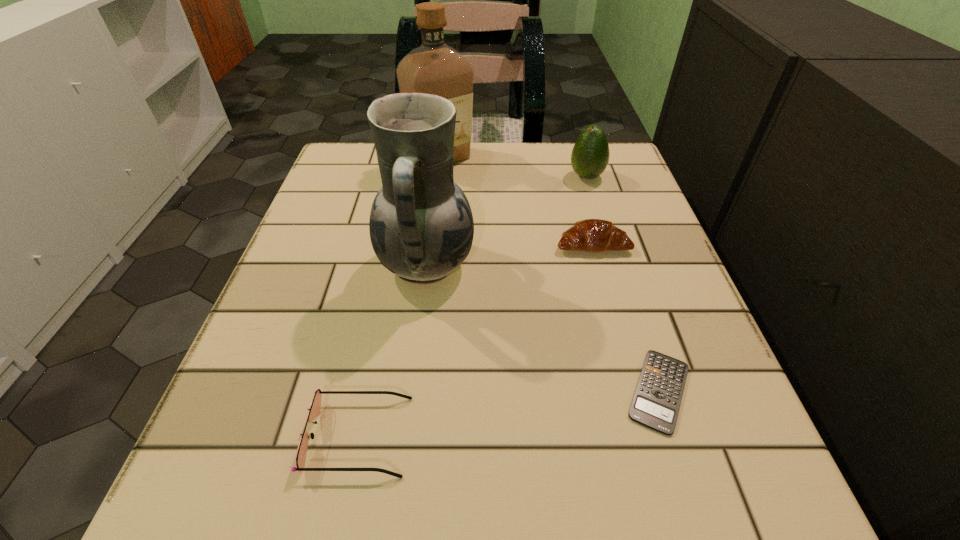
The image size is (960, 540). Identify the location of object located at the far right corner. (590, 155).

Where is `vacant area at the far edge of the desktop`? vacant area at the far edge of the desktop is located at coordinates (553, 172).

This screenshot has height=540, width=960. Identify the location of vacant space at the left edge. (367, 308).

You are a GUI agent. You are given a task and a screenshot of the screen. Output one action in this format:
    pyautogui.click(x=<x>, y=<y>)
    Task: Click on the free space at the right edge
    The width and height of the screenshot is (960, 540).
    Given the screenshot: What is the action you would take?
    pyautogui.click(x=577, y=217)

The width and height of the screenshot is (960, 540). What are the coordinates of `vacant space at the far left corner of the desktop` in the screenshot? It's located at (338, 186).

Identify the location of free spot at the near left corner of the desktop. The height and width of the screenshot is (540, 960). (257, 484).

At what (x,y) coordinates should I click in order to perform the action: click on vacant space at the far right corner of the desktop. Please return your answer as a coordinate pair (x, y). Looking at the image, I should click on (607, 193).

Where is `free space between the pitcher and the third shortest object`? free space between the pitcher and the third shortest object is located at coordinates (510, 255).

Identify the location of free spot between the second shortest object and the calculator. (509, 414).

At what (x,y) coordinates should I click in order to perform the action: click on free spot between the calculator and the pitcher. Please return your answer as a coordinate pair (x, y). The height and width of the screenshot is (540, 960). Looking at the image, I should click on (542, 328).